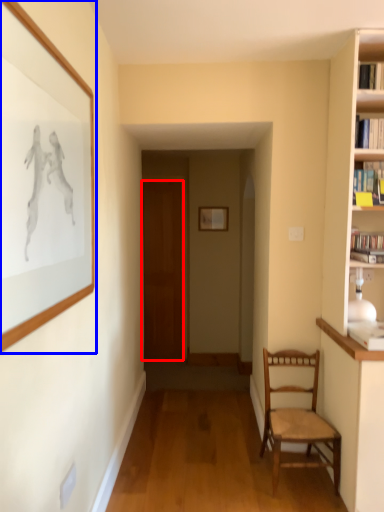
Question: Which object appears closest to the camera in this image, door (highlighted by a red box) or picture frame (highlighted by a blue box)?

Choices:
 (A) door
 (B) picture frame

Answer: (B)